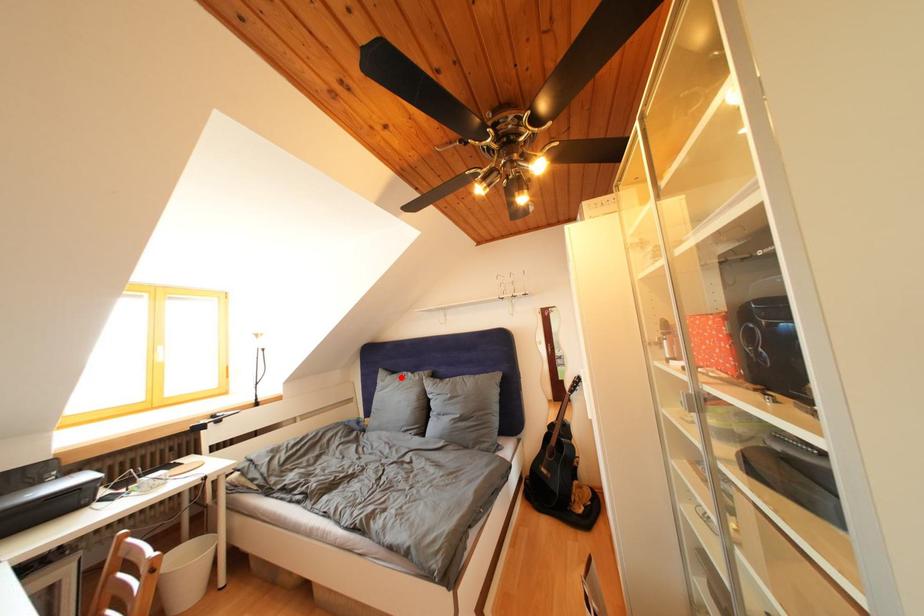
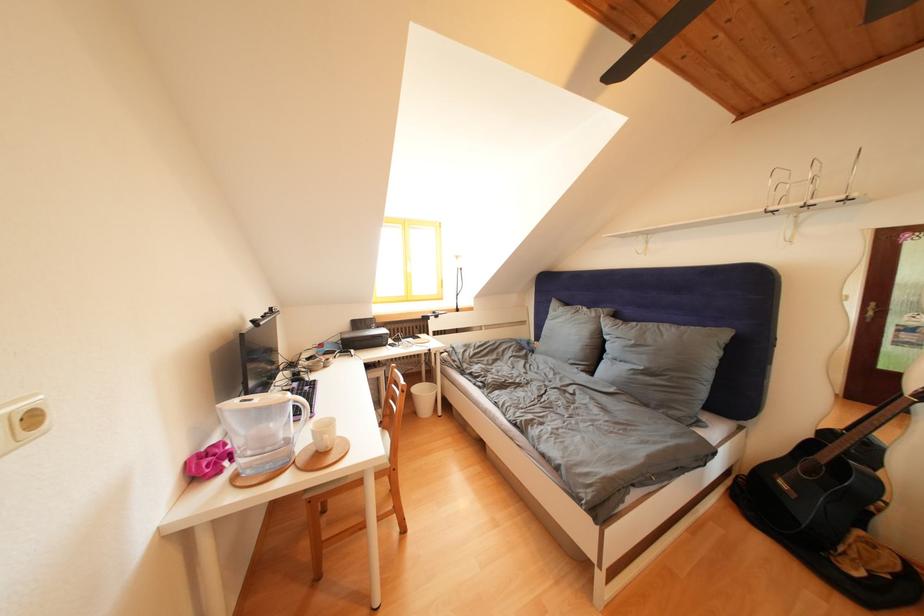
Find the pixel in the second image that matches the highlighted location in the first image.

(575, 310)